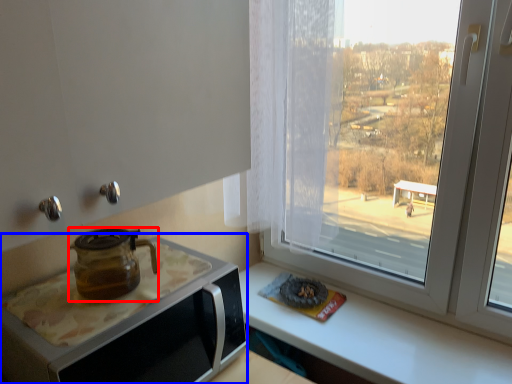
Question: Among these objects, which one is nearest to the camera, kitchen appliance (highlighted by a red box) or appliance (highlighted by a blue box)?

Choices:
 (A) kitchen appliance
 (B) appliance

Answer: (B)